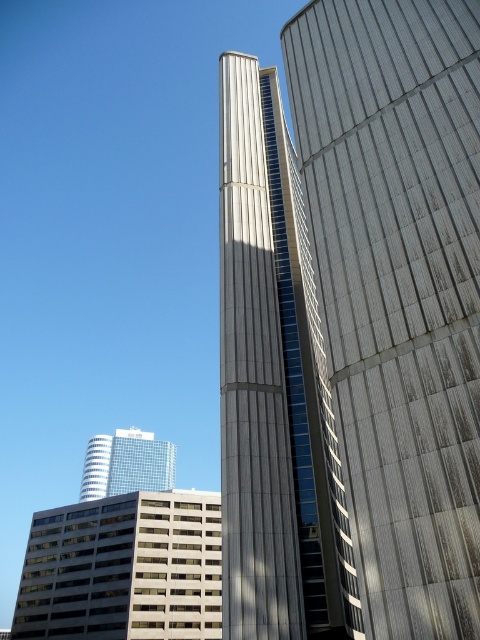
Can you confirm if gray textured building at right is shorter than glass windows building at center?

No.

Is gray textured building at right below glass windows building at center?

No, gray textured building at right is not below glass windows building at center.

You are a GUI agent. You are given a task and a screenshot of the screen. Output one action in this format:
    pyautogui.click(x=<x>, y=<y>)
    Task: Click on the gray textured building at right
    This screenshot has width=480, height=640.
    Given the screenshot: What is the action you would take?
    pyautogui.click(x=398, y=291)

Identify the location of gray textured building at right. (398, 291).

Can you confirm if clear glass skyscraper at center is positioned below glassy blue skyscraper at center?

Actually, clear glass skyscraper at center is above glassy blue skyscraper at center.

Who is positioned more to the right, clear glass skyscraper at center or glassy blue skyscraper at center?

clear glass skyscraper at center is more to the right.

Where is `clear glass skyscraper at center`? Image resolution: width=480 pixels, height=640 pixels. clear glass skyscraper at center is located at coordinates (140, 461).

At what (x,y) coordinates should I click in order to perform the action: click on clear glass skyscraper at center. Please return your answer as a coordinate pair (x, y). Looking at the image, I should click on (140, 461).

Does gray textured building at right have a lesser width compared to clear glass skyscraper at center?

Yes, gray textured building at right is thinner than clear glass skyscraper at center.

Can you confirm if gray textured building at right is wider than clear glass skyscraper at center?

Incorrect, gray textured building at right's width does not surpass clear glass skyscraper at center's.

Which is in front, point (389, 180) or point (133, 448)?

Positioned in front is point (389, 180).

Image resolution: width=480 pixels, height=640 pixels. I want to click on gray textured building at right, so click(398, 291).